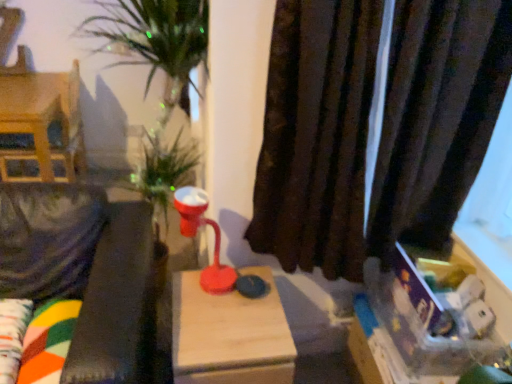
Question: Is wooden table at center closer to the viewer compared to matte plastic table lamp at center?

Choices:
 (A) no
 (B) yes

Answer: (B)

Question: Is wooden table at center further to camera compared to matte plastic table lamp at center?

Choices:
 (A) yes
 (B) no

Answer: (B)

Question: Is wooden table at center smaller than matte plastic table lamp at center?

Choices:
 (A) no
 (B) yes

Answer: (A)

Question: Can you confirm if wooden table at center is thinner than matte plastic table lamp at center?

Choices:
 (A) yes
 (B) no

Answer: (B)

Question: From a real-world perspective, is wooden table at center under matte plastic table lamp at center?

Choices:
 (A) no
 (B) yes

Answer: (B)

Question: Looking at their shapes, would you say matte plastic table lamp at center is wider or thinner than wooden dollhouse at left?

Choices:
 (A) wide
 (B) thin

Answer: (B)

Question: Considering the positions of matte plastic table lamp at center and wooden dollhouse at left in the image, is matte plastic table lamp at center taller or shorter than wooden dollhouse at left?

Choices:
 (A) short
 (B) tall

Answer: (A)

Question: From a real-world perspective, is matte plastic table lamp at center positioned above or below wooden dollhouse at left?

Choices:
 (A) above
 (B) below

Answer: (A)

Question: In the image, is matte plastic table lamp at center positioned in front of or behind wooden dollhouse at left?

Choices:
 (A) front
 (B) behind

Answer: (A)

Question: Is velvet green couch at left taller or shorter than brown velvet curtain at right?

Choices:
 (A) tall
 (B) short

Answer: (B)

Question: Considering their positions, is velvet green couch at left located in front of or behind brown velvet curtain at right?

Choices:
 (A) front
 (B) behind

Answer: (A)

Question: Is point (135, 319) closer or farther from the camera than point (444, 8)?

Choices:
 (A) farther
 (B) closer

Answer: (B)

Question: Considering the positions of velvet green couch at left and brown velvet curtain at right in the image, is velvet green couch at left wider or thinner than brown velvet curtain at right?

Choices:
 (A) wide
 (B) thin

Answer: (A)

Question: From a real-world perspective, is brown velvet curtain at right positioned above or below wooden dollhouse at left?

Choices:
 (A) below
 (B) above

Answer: (B)

Question: From the image's perspective, relative to wooden dollhouse at left, is brown velvet curtain at right above or below?

Choices:
 (A) above
 (B) below

Answer: (B)